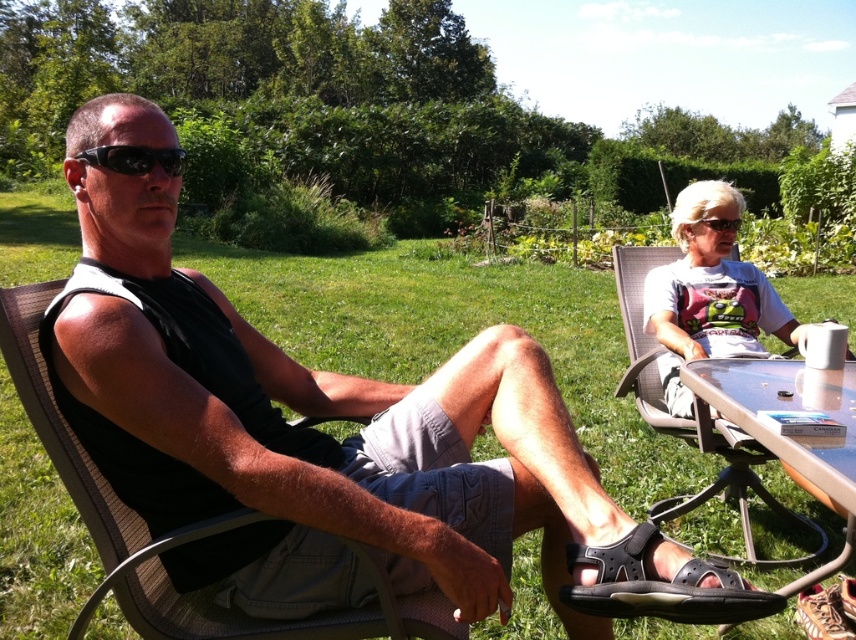
Question: Can you confirm if brown mesh chair at left is positioned to the left of black rubber sandal at lower center?

Choices:
 (A) no
 (B) yes

Answer: (B)

Question: Is brown mesh chair at left to the right of gray fabric chair at right from the viewer's perspective?

Choices:
 (A) no
 (B) yes

Answer: (A)

Question: Which object appears farthest from the camera in this image?

Choices:
 (A) black matte sunglasses at upper left
 (B) black rubber sandal at lower center
 (C) matte black goggles at upper right

Answer: (C)

Question: Which object is closer to the camera taking this photo?

Choices:
 (A) gray fabric chair at right
 (B) black fabric tank top at left

Answer: (B)

Question: Does gray fabric chair at right have a lesser width compared to black rubber sandal at lower center?

Choices:
 (A) no
 (B) yes

Answer: (A)

Question: Which point is farther to the camera?

Choices:
 (A) transparent glass table at lower right
 (B) black fabric tank top at left
 (C) brown mesh chair at left
 (D) matte black goggles at upper right

Answer: (D)